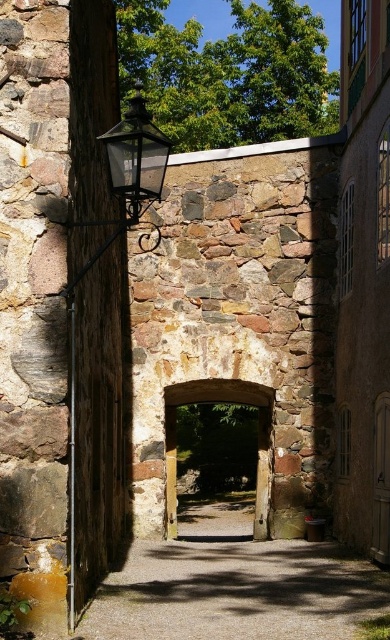
Question: Is matte black lantern at upper left bigger than wooden door at center?

Choices:
 (A) yes
 (B) no

Answer: (A)

Question: Is matte black lantern at left above wooden door at center?

Choices:
 (A) no
 (B) yes

Answer: (B)

Question: Estimate the real-world distances between objects in this image. Which object is farther from the wooden door at center?

Choices:
 (A) matte black lantern at left
 (B) matte black lantern at upper left

Answer: (A)

Question: Among these objects, which one is nearest to the camera?

Choices:
 (A) matte black lantern at left
 (B) matte black lantern at upper left

Answer: (A)

Question: Can you confirm if matte black lantern at left is positioned to the right of wooden door at center?

Choices:
 (A) no
 (B) yes

Answer: (A)

Question: Which point is closer to the camera taking this photo?

Choices:
 (A) (115, 193)
 (B) (118, 182)

Answer: (B)